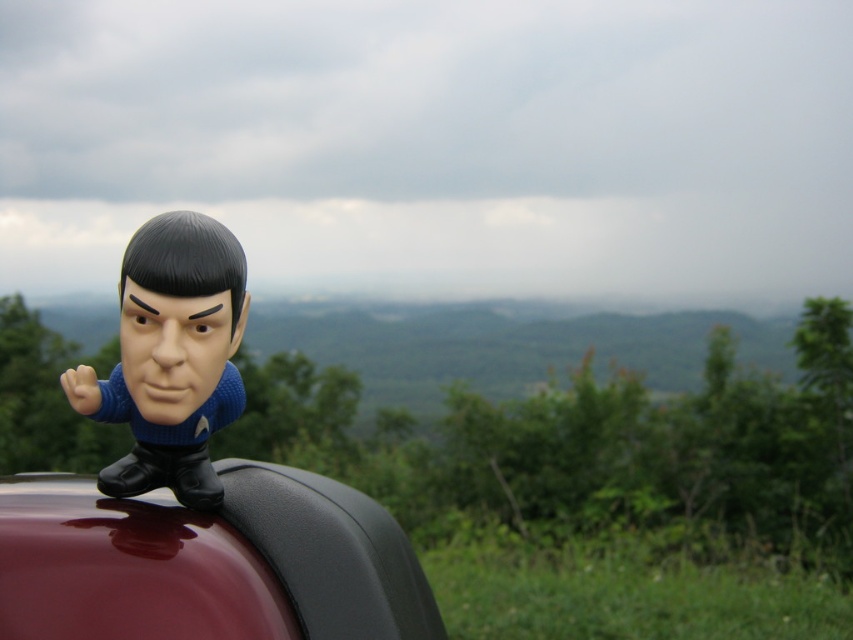
You are a photographer setting up a shoot. You have a glossy black car at upper center and a matte black bobblehead at upper left in your frame. Which object is positioned lower in the image?

The glossy black car at upper center is positioned below the matte black bobblehead at upper left, so the glossy black car at upper center is lower in the image.

You are a photographer setting up a shoot. You have a glossy black car at upper center and a matte black bobblehead at upper left. According to the scene, which object is positioned to the right of the other?

The glossy black car at upper center is to the left of the matte black bobblehead at upper left, so the matte black bobblehead at upper left is positioned to the right of the glossy black car at upper center.